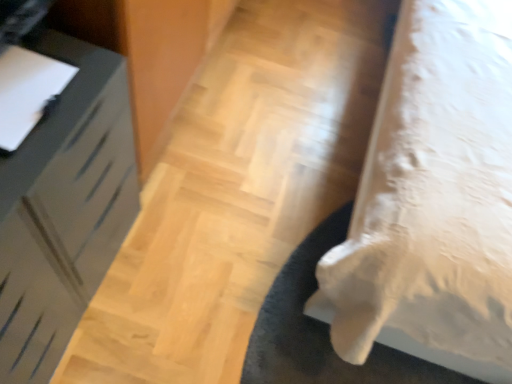
Question: From a real-world perspective, is white fabric bed at lower right, the second furniture positioned from the left, below black fuzzy mat at lower right?

Choices:
 (A) no
 (B) yes

Answer: (A)

Question: Is white fabric bed at lower right, the second furniture positioned from the left, facing away from black fuzzy mat at lower right?

Choices:
 (A) no
 (B) yes

Answer: (A)

Question: Can you confirm if white fabric bed at lower right, arranged as the first furniture when viewed from the right, is smaller than black fuzzy mat at lower right?

Choices:
 (A) no
 (B) yes

Answer: (A)

Question: Is white fabric bed at lower right, arranged as the first furniture when viewed from the right, outside black fuzzy mat at lower right?

Choices:
 (A) yes
 (B) no

Answer: (A)

Question: Does white fabric bed at lower right, the second furniture positioned from the left, touch black fuzzy mat at lower right?

Choices:
 (A) yes
 (B) no

Answer: (B)

Question: Which is correct: black fuzzy mat at lower right is inside white glossy drawer at left, the 1th furniture viewed from the left, or outside of it?

Choices:
 (A) inside
 (B) outside

Answer: (B)

Question: From their relative heights in the image, would you say black fuzzy mat at lower right is taller or shorter than white glossy drawer at left, the 1th furniture viewed from the left?

Choices:
 (A) tall
 (B) short

Answer: (B)

Question: Is black fuzzy mat at lower right wider or thinner than white glossy drawer at left, the 1th furniture viewed from the left?

Choices:
 (A) thin
 (B) wide

Answer: (B)

Question: Relative to white glossy drawer at left, the 1th furniture viewed from the left, is black fuzzy mat at lower right in front or behind?

Choices:
 (A) behind
 (B) front

Answer: (A)

Question: In terms of size, does black fuzzy mat at lower right appear bigger or smaller than white fabric bed at lower right, the second furniture positioned from the left?

Choices:
 (A) big
 (B) small

Answer: (B)

Question: In the image, is black fuzzy mat at lower right on the left side or the right side of white fabric bed at lower right, arranged as the first furniture when viewed from the right?

Choices:
 (A) left
 (B) right

Answer: (A)

Question: Is black fuzzy mat at lower right spatially inside white fabric bed at lower right, arranged as the first furniture when viewed from the right, or outside of it?

Choices:
 (A) outside
 (B) inside

Answer: (A)

Question: Looking at their shapes, would you say black fuzzy mat at lower right is wider or thinner than white fabric bed at lower right, arranged as the first furniture when viewed from the right?

Choices:
 (A) wide
 (B) thin

Answer: (B)

Question: Is point (17, 360) positioned closer to the camera than point (486, 115)?

Choices:
 (A) farther
 (B) closer

Answer: (B)

Question: In the image, is white glossy drawer at left, the 1th furniture viewed from the left, positioned in front of or behind white fabric bed at lower right, arranged as the first furniture when viewed from the right?

Choices:
 (A) front
 (B) behind

Answer: (B)